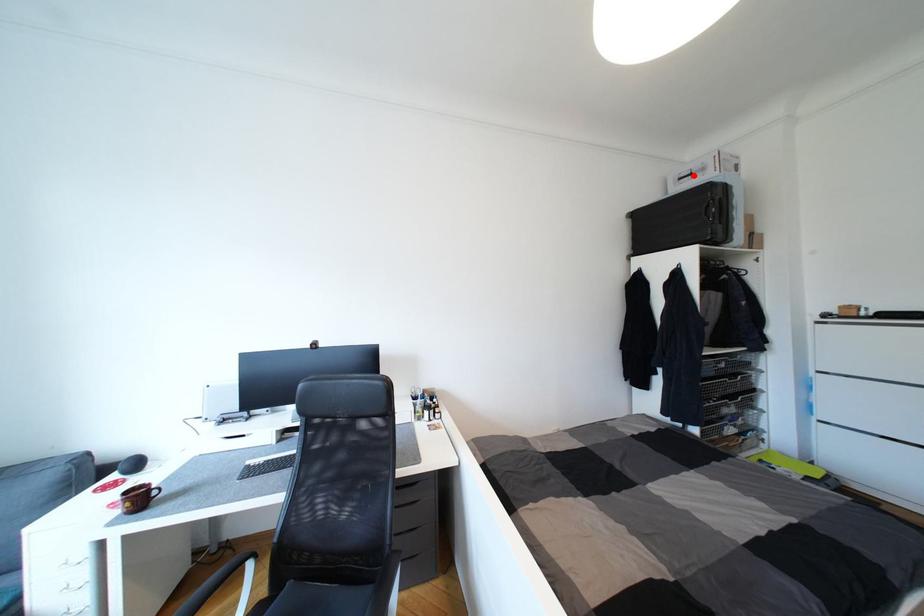
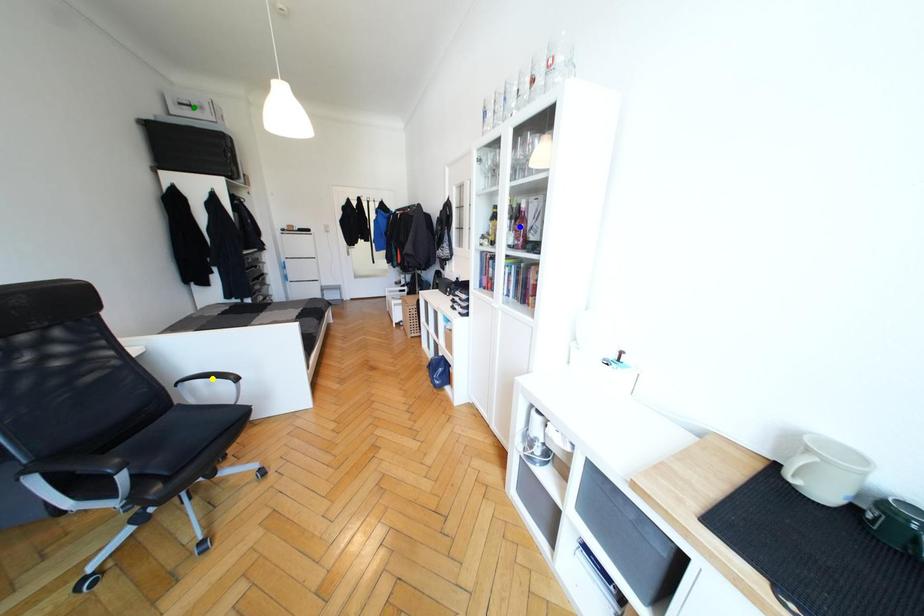
Question: I am providing you with two images of the same scene from different viewpoints. A red point is marked on the first image. You are given multiple points on the second image. Which point in image 2 is actually the same real-world point as the red point in image 1?

Choices:
 (A) green point
 (B) yellow point
 (C) blue point

Answer: (A)